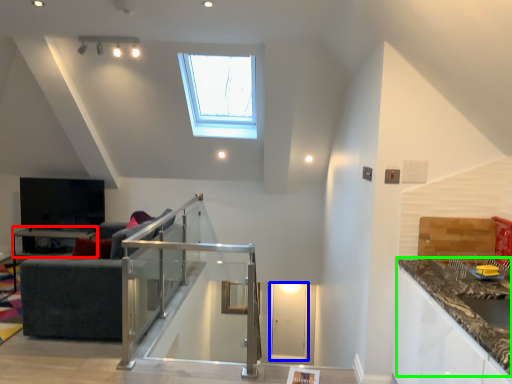
Question: Which object is the farthest from table (highlighted by a red box)? Choose among these: glass door (highlighted by a blue box) or countertop (highlighted by a green box).

Choices:
 (A) glass door
 (B) countertop

Answer: (B)